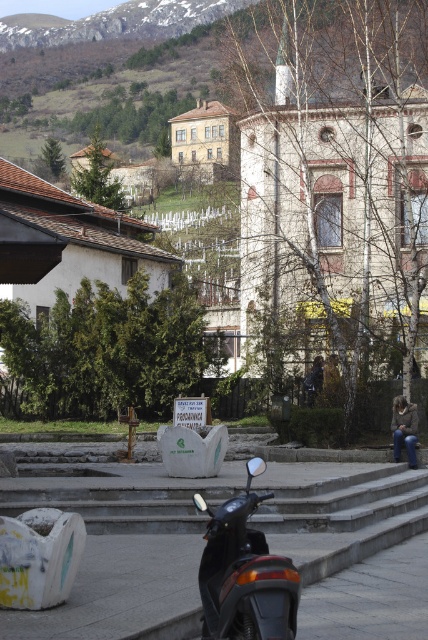
You are standing at the base of the steps leading up to the plaza and want to walk towards the sign with Cyrillic text behind the fountain. Which point, point 1 at coordinates [210,589] or point 2 at coordinates [401,440], would you pass closer to as you move forward?

Point 1 at coordinates [210,589] is closer to the viewer, so as you move forward towards the sign, you would pass closer to point 1 at coordinates [210,589] first before reaching point 2 at coordinates [401,440].

You are a delivery person who needs to pick up a brown leather jacket at lower right. The black matte scooter at lower center is blocking your path. Can you move the scooter to access the jacket?

The black matte scooter at lower center is located above the brown leather jacket at lower right, meaning the scooter is positioned higher up and might not directly block the path. However, since it is above the jacket, moving it could provide better access.

You are a tourist visiting this area and want to take a photo of both the black matte scooter at lower center and the brown leather jacket at lower right in the same frame. Based on their positions, which object should you place on the left side of your photo to include both?

The black matte scooter at lower center is already positioned on the left side of the brown leather jacket at lower right, so to include both in the same frame, you should place the black matte scooter at lower center on the left side of your photo.